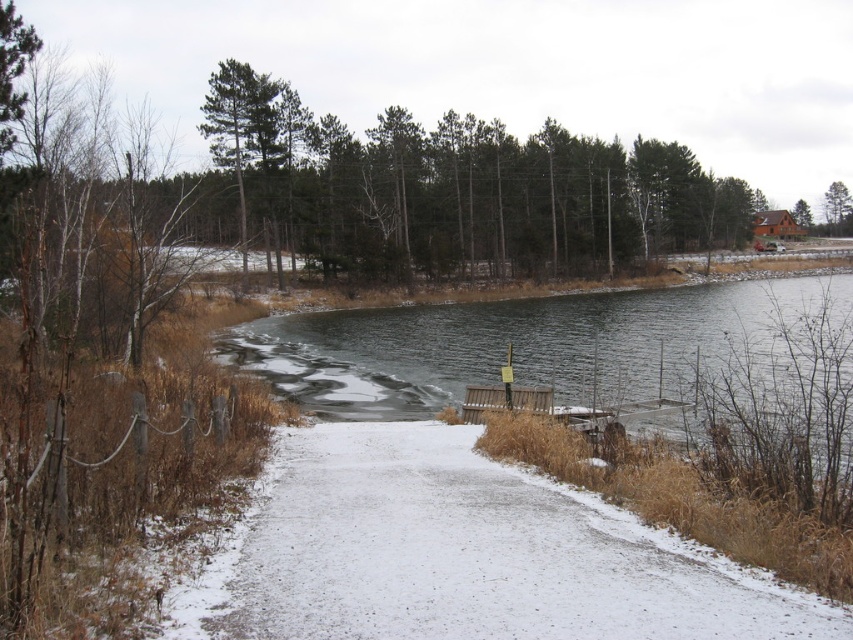
Question: Does green matte tree at upper right have a greater width compared to brown wood tree at upper right?

Choices:
 (A) yes
 (B) no

Answer: (B)

Question: Which object appears farthest from the camera in this image?

Choices:
 (A) green matte tree at upper right
 (B) brown wood tree at upper right

Answer: (A)

Question: Which point is closer to the camera?

Choices:
 (A) (383, 470)
 (B) (805, 212)

Answer: (A)

Question: Does green matte tree at upper right appear on the right side of brown wood tree at upper right?

Choices:
 (A) no
 (B) yes

Answer: (B)

Question: Which of these objects is positioned closest to the white snow-covered path at center?

Choices:
 (A) brown wood tree at upper right
 (B) green matte tree at upper right

Answer: (A)

Question: Can you confirm if white snow-covered path at center is positioned to the left of green matte tree at upper right?

Choices:
 (A) yes
 (B) no

Answer: (A)